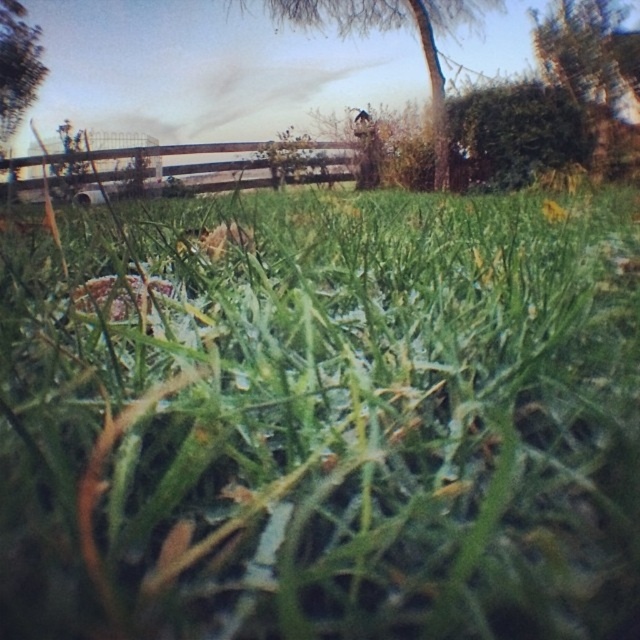
Question: Which is nearer to the green leafy tree at upper left?

Choices:
 (A) green leafy tree at upper center
 (B) green matte grass at center

Answer: (A)

Question: Which of the following is the closest to the observer?

Choices:
 (A) (566, 6)
 (B) (404, 17)
 (C) (122, 323)
 (D) (24, 61)

Answer: (C)

Question: Which of the following is the farthest from the observer?

Choices:
 (A) green leafy tree at upper left
 (B) green matte grass at center

Answer: (A)

Question: From the image, what is the correct spatial relationship of green leafy tree at upper center in relation to green leafy tree at upper left?

Choices:
 (A) left
 (B) right

Answer: (B)

Question: Can you confirm if green leafy tree at upper center is bigger than green leafy tree at upper left?

Choices:
 (A) no
 (B) yes

Answer: (A)

Question: Is the position of green leafy tree at upper right less distant than that of green leafy tree at upper left?

Choices:
 (A) yes
 (B) no

Answer: (A)